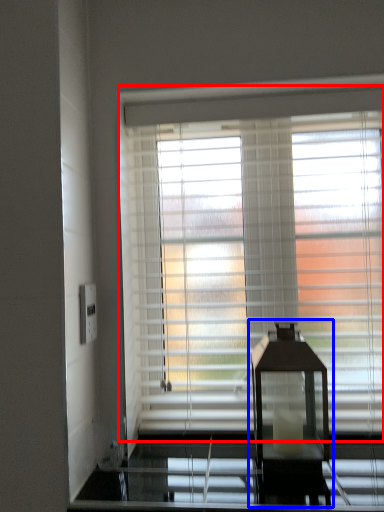
Question: Which object appears farthest to the camera in this image, window blind (highlighted by a red box) or table lamp (highlighted by a blue box)?

Choices:
 (A) window blind
 (B) table lamp

Answer: (A)